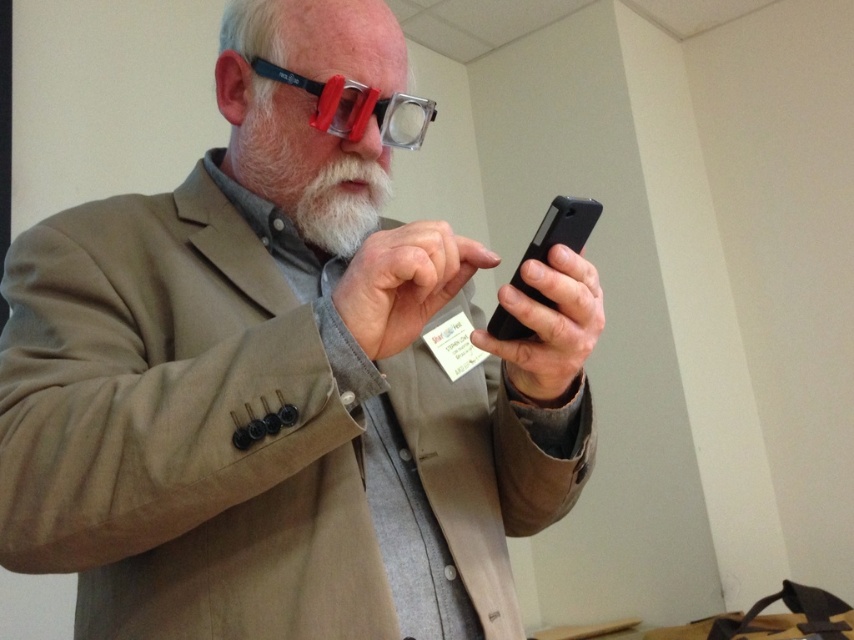
Question: Which of the following is the closest to the observer?

Choices:
 (A) (522, 332)
 (B) (551, 282)
 (C) (349, 156)
 (D) (446, 369)

Answer: (B)

Question: Which point is closer to the camera?

Choices:
 (A) white matte beard at center
 (B) white matte paper at center
 (C) transparent plastic goggles at upper center
 (D) matte black phone at center

Answer: (D)

Question: Observing the image, what is the correct spatial positioning of white matte beard at center in reference to transparent plastic goggles at upper center?

Choices:
 (A) left
 (B) right

Answer: (A)

Question: Is the position of black matte smartphone at center less distant than that of white matte paper at center?

Choices:
 (A) yes
 (B) no

Answer: (A)

Question: Can you confirm if matte black phone at center is smaller than transparent plastic goggles at upper center?

Choices:
 (A) yes
 (B) no

Answer: (B)

Question: Which of the following is the farthest from the observer?

Choices:
 (A) matte black phone at center
 (B) white matte beard at center
 (C) transparent plastic goggles at upper center
 (D) white matte paper at center

Answer: (D)